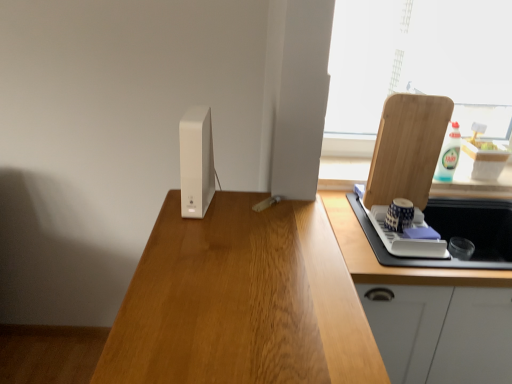
Identify the location of white matte router at center, which is the 1th appliance in left-to-right order. (196, 162).

Image resolution: width=512 pixels, height=384 pixels. What do you see at coordinates (399, 215) in the screenshot?
I see `blue and white ceramic cup at right, acting as the second appliance starting from the top` at bounding box center [399, 215].

Describe the element at coordinates (407, 148) in the screenshot. This screenshot has width=512, height=384. I see `wooden cutting board at right` at that location.

Identify the location of white matte router at center, which is the second appliance in bottom-to-top order. This screenshot has width=512, height=384. (196, 162).

Are transparent glass window at upper right and white glossy cabinet at right far apart?

Indeed, transparent glass window at upper right is not near white glossy cabinet at right.

The height and width of the screenshot is (384, 512). Find the location of `window behind the white glossy cabinet at right`. window behind the white glossy cabinet at right is located at coordinates (413, 70).

Considering their positions, is transparent glass window at upper right located in front of or behind white glossy cabinet at right?

transparent glass window at upper right is behind white glossy cabinet at right.

Is point (343, 19) in front of point (342, 202)?

No, it is behind (342, 202).

Considering the sizes of objects white glossy cabinet at right and blue and white ceramic cup at right, acting as the second appliance starting from the left, in the image provided, who is bigger, white glossy cabinet at right or blue and white ceramic cup at right, acting as the second appliance starting from the left,?

With larger size is white glossy cabinet at right.

Is white glossy cabinet at right not within blue and white ceramic cup at right, placed as the first appliance when sorted from right to left?

Yes, white glossy cabinet at right is not within blue and white ceramic cup at right, placed as the first appliance when sorted from right to left.

How many degrees apart are the facing directions of white glossy cabinet at right and blue and white ceramic cup at right, which appears as the first appliance when viewed from the back?

The facing directions of white glossy cabinet at right and blue and white ceramic cup at right, which appears as the first appliance when viewed from the back, are 0.000201 degrees apart.

This screenshot has height=384, width=512. In order to click on cabinetry in front of the blue and white ceramic cup at right, placed as the first appliance when sorted from right to left in this screenshot , I will do `click(429, 312)`.

Considering the sizes of blue and white ceramic cup at right, placed as the first appliance when sorted from right to left, and transparent glass window at upper right in the image, is blue and white ceramic cup at right, placed as the first appliance when sorted from right to left, wider or thinner than transparent glass window at upper right?

blue and white ceramic cup at right, placed as the first appliance when sorted from right to left, is wider than transparent glass window at upper right.

I want to click on window on the right of the blue and white ceramic cup at right, the 1th appliance from the bottom, so click(x=413, y=70).

Could you tell me if blue and white ceramic cup at right, positioned as the 2th appliance in front-to-back order, is facing transparent glass window at upper right?

No, blue and white ceramic cup at right, positioned as the 2th appliance in front-to-back order, is not aimed at transparent glass window at upper right.

Can you confirm if blue and white ceramic cup at right, which appears as the first appliance when viewed from the back, is bigger than transparent glass window at upper right?

Actually, blue and white ceramic cup at right, which appears as the first appliance when viewed from the back, might be smaller than transparent glass window at upper right.

Which of these two, transparent glass window at upper right or wooden cutting board at right, is smaller?

wooden cutting board at right is smaller.

Considering the relative sizes of transparent glass window at upper right and wooden cutting board at right in the image provided, is transparent glass window at upper right shorter than wooden cutting board at right?

Answer: No.

Find the location of a particular element. cutting board on the left of transparent glass window at upper right is located at coordinates (407, 148).

Is transparent glass window at upper right facing towards wooden cutting board at right?

Yes, transparent glass window at upper right is facing wooden cutting board at right.

From the image's perspective, between transparent glass window at upper right and white plastic bottle at upper right, which one is located above?

transparent glass window at upper right.

In the image, is transparent glass window at upper right positioned in front of or behind white plastic bottle at upper right?

In the image, transparent glass window at upper right appears behind white plastic bottle at upper right.

Is transparent glass window at upper right bigger than white plastic bottle at upper right?

Indeed, transparent glass window at upper right has a larger size compared to white plastic bottle at upper right.

Is transparent glass window at upper right aimed at white plastic bottle at upper right?

Yes, transparent glass window at upper right is facing white plastic bottle at upper right.

Considering the positions of objects transparent glass window at upper right and white matte router at center, which is the second appliance in bottom-to-top order, in the image provided, who is more to the left, transparent glass window at upper right or white matte router at center, which is the second appliance in bottom-to-top order,?

white matte router at center, which is the second appliance in bottom-to-top order, is more to the left.

From a real-world perspective, is transparent glass window at upper right positioned over white matte router at center, which is the 1th appliance in left-to-right order, based on gravity?

Indeed, from a real-world perspective, transparent glass window at upper right stands above white matte router at center, which is the 1th appliance in left-to-right order.

How much distance is there between transparent glass window at upper right and white matte router at center, the 1th appliance from the top?

9.30 feet.

Can you confirm if transparent glass window at upper right is shorter than white matte router at center, which is the second appliance in bottom-to-top order?

In fact, transparent glass window at upper right may be taller than white matte router at center, which is the second appliance in bottom-to-top order.

Is wooden cutting board at right to the right of white glossy cabinet at right from the viewer's perspective?

In fact, wooden cutting board at right is to the left of white glossy cabinet at right.

Considering the relative sizes of wooden cutting board at right and white glossy cabinet at right in the image provided, is wooden cutting board at right shorter than white glossy cabinet at right?

Indeed, wooden cutting board at right has a lesser height compared to white glossy cabinet at right.

Is wooden cutting board at right spatially inside white glossy cabinet at right, or outside of it?

wooden cutting board at right lies outside white glossy cabinet at right.

Where is `cabinetry below the transparent glass window at upper right (from the image's perspective)`? cabinetry below the transparent glass window at upper right (from the image's perspective) is located at coordinates (429, 312).

Identify the location of the 1st appliance positioned above the white glossy cabinet at right (from a real-world perspective). This screenshot has width=512, height=384. (399, 215).

Based on their spatial positions, is white plastic bottle at upper right or transparent glass window at upper right further from blue and white ceramic cup at right, which appears as the first appliance when viewed from the back?

transparent glass window at upper right is positioned further to the anchor blue and white ceramic cup at right, which appears as the first appliance when viewed from the back.

When comparing their distances from blue and white ceramic cup at right, the 1th appliance from the bottom, does white glossy cabinet at right or wooden cutting board at right seem further?

white glossy cabinet at right.

Which object lies further to the anchor point wooden cutting board at right, blue and white ceramic cup at right, the 1th appliance from the bottom, or white plastic bottle at upper right?

white plastic bottle at upper right lies further to wooden cutting board at right than the other object.

Based on their spatial positions, is white matte router at center, the 1th appliance from the top, or transparent glass window at upper right closer to wooden cutting board at right?

Among the two, white matte router at center, the 1th appliance from the top, is located nearer to wooden cutting board at right.

Estimate the real-world distances between objects in this image. Which object is closer to wooden cutting board at right, white matte router at center, the 1th appliance from the top, or blue and white ceramic cup at right, placed as the first appliance when sorted from right to left?

The object closer to wooden cutting board at right is blue and white ceramic cup at right, placed as the first appliance when sorted from right to left.

Estimate the real-world distances between objects in this image. Which object is closer to transparent glass window at upper right, white plastic bottle at upper right or white matte router at center, which is counted as the 2th appliance, starting from the back?

Among the two, white plastic bottle at upper right is located nearer to transparent glass window at upper right.

Which object lies nearer to the anchor point wooden cutting board at right, blue and white ceramic cup at right, positioned as the 2th appliance in front-to-back order, or white matte router at center, which is counted as the 2th appliance, starting from the back?

Based on the image, blue and white ceramic cup at right, positioned as the 2th appliance in front-to-back order, appears to be nearer to wooden cutting board at right.

From the picture: Based on their spatial positions, is transparent glass window at upper right or white matte router at center, the second appliance positioned from the right, closer to white plastic bottle at upper right?

The object closer to white plastic bottle at upper right is white matte router at center, the second appliance positioned from the right.

At what (x,y) coordinates should I click in order to perform the action: click on cutting board located between white matte router at center, which is counted as the 2th appliance, starting from the back, and transparent glass window at upper right in the left-right direction. Please return your answer as a coordinate pair (x, y). The width and height of the screenshot is (512, 384). Looking at the image, I should click on (407, 148).

This screenshot has height=384, width=512. In order to click on bottle between transparent glass window at upper right and blue and white ceramic cup at right, the 1th appliance from the bottom, from top to bottom in this screenshot , I will do `click(449, 155)`.

Identify the location of cutting board between transparent glass window at upper right and white glossy cabinet at right vertically. (407, 148).

At what (x,y) coordinates should I click in order to perform the action: click on cutting board between transparent glass window at upper right and blue and white ceramic cup at right, positioned as the 2th appliance in front-to-back order, from top to bottom. Please return your answer as a coordinate pair (x, y). This screenshot has width=512, height=384. Looking at the image, I should click on (407, 148).